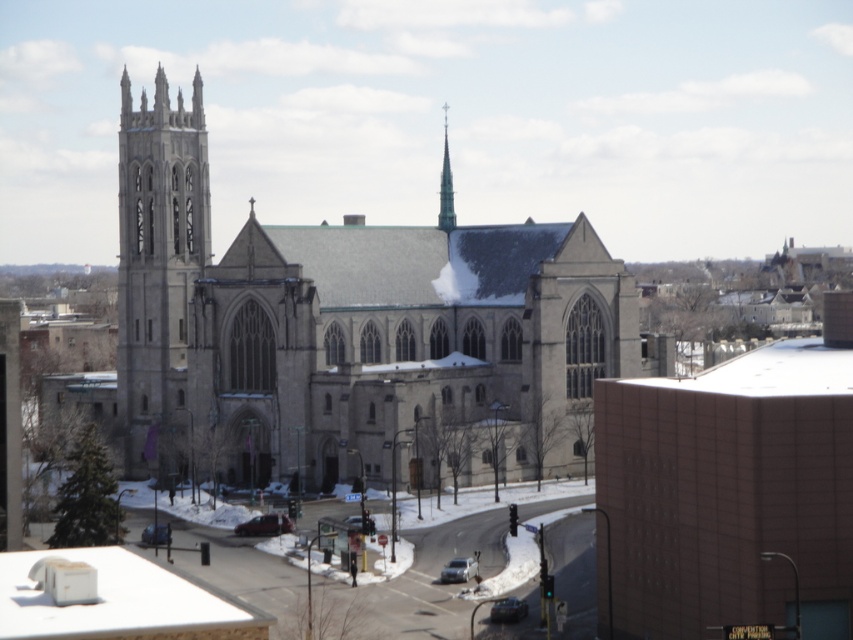
Consider the image. Does gray stone church at center appear on the right side of gray stone tower at left?

Yes, gray stone church at center is to the right of gray stone tower at left.

Is gray stone church at center taller than gray stone tower at left?

No.

Who is more distant from viewer, (595,288) or (165,161)?

Positioned behind is point (165,161).

Where is `gray stone church at center`? The height and width of the screenshot is (640, 853). gray stone church at center is located at coordinates (347, 330).

Which is in front, point (195, 237) or point (447, 224)?

Positioned in front is point (195, 237).

Is point (190, 227) behind point (444, 211)?

No, (190, 227) is in front of (444, 211).

You are a GUI agent. You are given a task and a screenshot of the screen. Output one action in this format:
    pyautogui.click(x=<x>, y=<y>)
    Task: Click on the gray stone tower at left
    This screenshot has width=853, height=640.
    Given the screenshot: What is the action you would take?
    pyautogui.click(x=158, y=269)

Is gray stone church at center smaller than green glass spire at upper center?

Actually, gray stone church at center might be larger than green glass spire at upper center.

Between gray stone church at center and green glass spire at upper center, which one appears on the right side from the viewer's perspective?

green glass spire at upper center is more to the right.

Is point (311, 417) farther from camera compared to point (444, 136)?

No, it is in front of (444, 136).

You are a GUI agent. You are given a task and a screenshot of the screen. Output one action in this format:
    pyautogui.click(x=<x>, y=<y>)
    Task: Click on the gray stone church at center
    This screenshot has width=853, height=640.
    Given the screenshot: What is the action you would take?
    pyautogui.click(x=347, y=330)